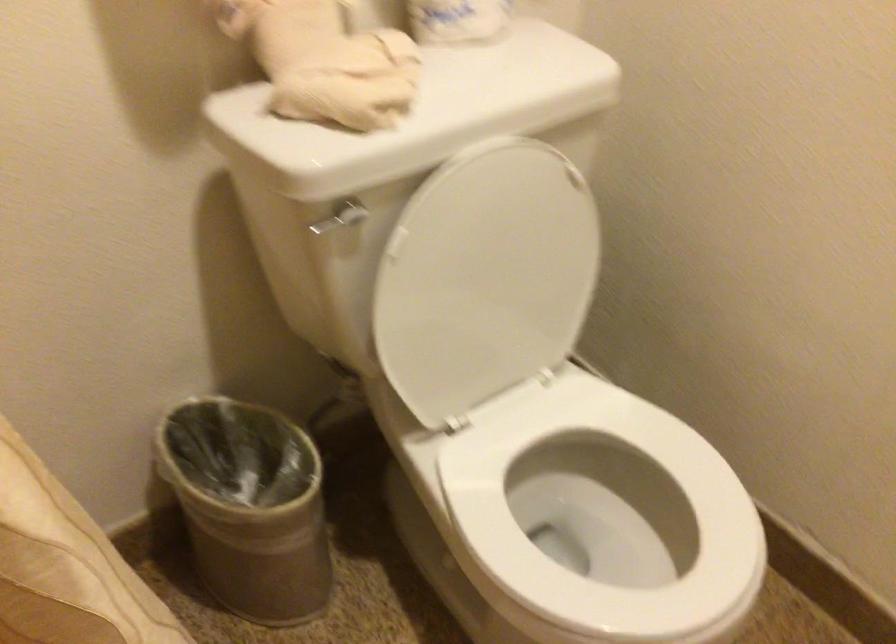
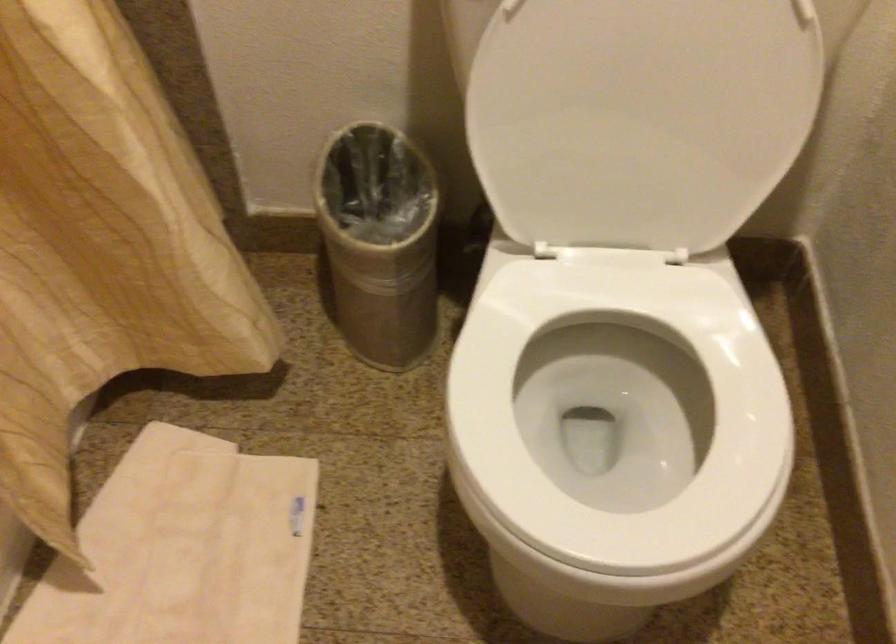
In the second image, find the point that corresponds to pixel 298 500 in the first image.

(380, 242)